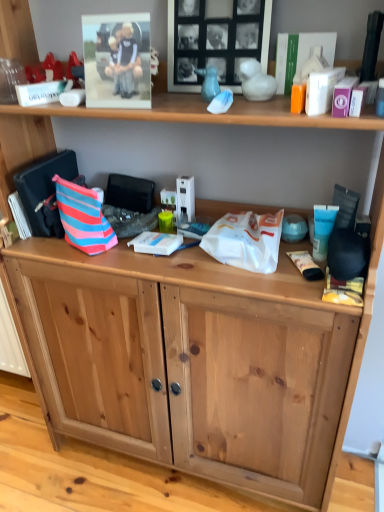
Question: From the image's perspective, does black matte picture frame at upper center, which is the second picture frame from left to right, appear lower than matte plastic photo frame at upper left, which is the 1th picture frame in left-to-right order?

Choices:
 (A) yes
 (B) no

Answer: (B)

Question: From the image's perspective, is black matte picture frame at upper center, which is the second picture frame from left to right, located above matte plastic photo frame at upper left, which is the 1th picture frame in left-to-right order?

Choices:
 (A) yes
 (B) no

Answer: (A)

Question: Is black matte picture frame at upper center, positioned as the first picture frame in right-to-left order, closer to camera compared to matte plastic photo frame at upper left, which is the 1th picture frame in left-to-right order?

Choices:
 (A) no
 (B) yes

Answer: (A)

Question: Considering the relative sizes of black matte picture frame at upper center, which is the second picture frame from left to right, and matte plastic photo frame at upper left, the second picture frame in the right-to-left sequence, in the image provided, is black matte picture frame at upper center, which is the second picture frame from left to right, shorter than matte plastic photo frame at upper left, the second picture frame in the right-to-left sequence,?

Choices:
 (A) no
 (B) yes

Answer: (A)

Question: Considering the relative sizes of black matte picture frame at upper center, positioned as the first picture frame in right-to-left order, and matte plastic photo frame at upper left, the second picture frame in the right-to-left sequence, in the image provided, is black matte picture frame at upper center, positioned as the first picture frame in right-to-left order, wider than matte plastic photo frame at upper left, the second picture frame in the right-to-left sequence,?

Choices:
 (A) yes
 (B) no

Answer: (A)

Question: Based on their sizes in the image, would you say white plastic book at center, acting as the second book starting from the right, is bigger or smaller than white plastic bag at center?

Choices:
 (A) small
 (B) big

Answer: (A)

Question: From a real-world perspective, is white plastic book at center, acting as the second book starting from the right, physically located above or below white plastic bag at center?

Choices:
 (A) below
 (B) above

Answer: (A)

Question: From their relative heights in the image, would you say white plastic book at center, which is the 3th book in top-to-bottom order, is taller or shorter than white plastic bag at center?

Choices:
 (A) short
 (B) tall

Answer: (A)

Question: Does point (157, 248) appear closer or farther from the camera than point (226, 261)?

Choices:
 (A) closer
 (B) farther

Answer: (B)

Question: Is white matte book at upper right, marked as the 3th book in a left-to-right arrangement, inside the boundaries of blue cream tube at right, or outside?

Choices:
 (A) outside
 (B) inside

Answer: (A)

Question: From the image's perspective, relative to blue cream tube at right, is white matte book at upper right, which is the first book in top-to-bottom order, above or below?

Choices:
 (A) below
 (B) above

Answer: (B)

Question: Considering their positions, is white matte book at upper right, arranged as the 3th book when ordered from the bottom, located in front of or behind blue cream tube at right?

Choices:
 (A) behind
 (B) front

Answer: (B)

Question: From their relative heights in the image, would you say white matte book at upper right, which is the first book in top-to-bottom order, is taller or shorter than blue cream tube at right?

Choices:
 (A) tall
 (B) short

Answer: (B)

Question: From the image's perspective, is white plastic bag at center positioned above or below natural wood cabinet at lower center?

Choices:
 (A) above
 (B) below

Answer: (A)

Question: Is white plastic bag at center taller or shorter than natural wood cabinet at lower center?

Choices:
 (A) short
 (B) tall

Answer: (A)